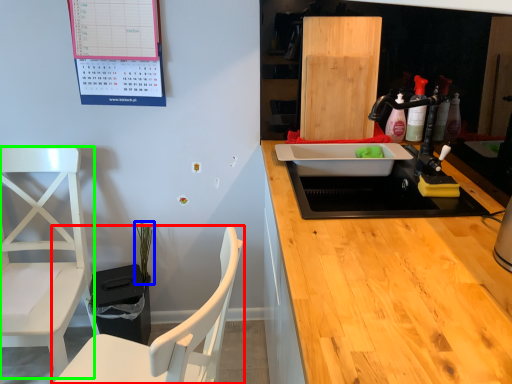
Question: Which object is positioned farthest from chair (highlighted by a red box)? Select from plant (highlighted by a blue box) and chair (highlighted by a green box).

Choices:
 (A) plant
 (B) chair

Answer: (A)